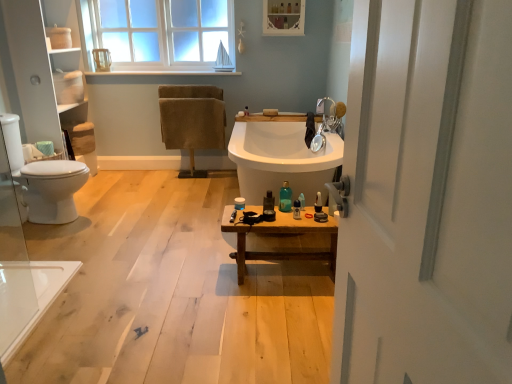
Locate an element on the screen. Image resolution: width=512 pixels, height=384 pixels. free area in between wooden bench at center and white glossy toilet at left is located at coordinates (142, 238).